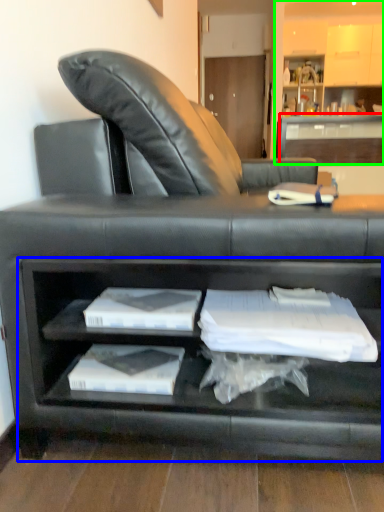
Question: Estimate the real-world distances between objects in this image. Which object is closer to table (highlighted by a red box), cabinet (highlighted by a blue box) or entertainment center (highlighted by a green box)?

Choices:
 (A) cabinet
 (B) entertainment center

Answer: (B)